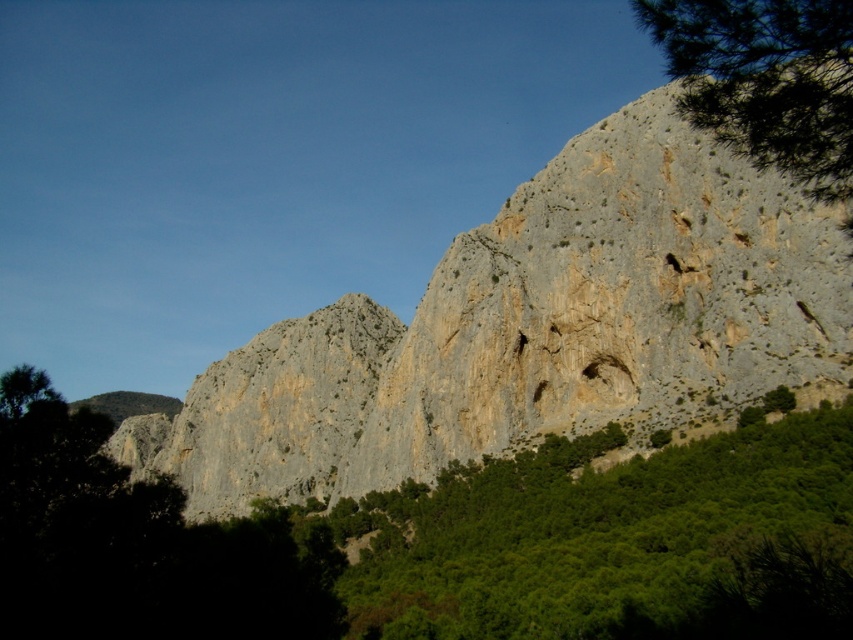
Is green leafy tree at center smaller than green leafy tree at upper right?

Incorrect, green leafy tree at center is not smaller in size than green leafy tree at upper right.

This screenshot has width=853, height=640. Find the location of `green leafy tree at center`. green leafy tree at center is located at coordinates click(x=137, y=544).

The image size is (853, 640). Identify the location of gray rock formation at center. (532, 326).

Which is in front, point (592, 276) or point (793, 120)?

Positioned in front is point (793, 120).

This screenshot has height=640, width=853. I want to click on gray rock formation at center, so click(x=532, y=326).

Does gray rock formation at center appear over green leafy tree at center?

Indeed, gray rock formation at center is positioned over green leafy tree at center.

Identify the location of gray rock formation at center. (532, 326).